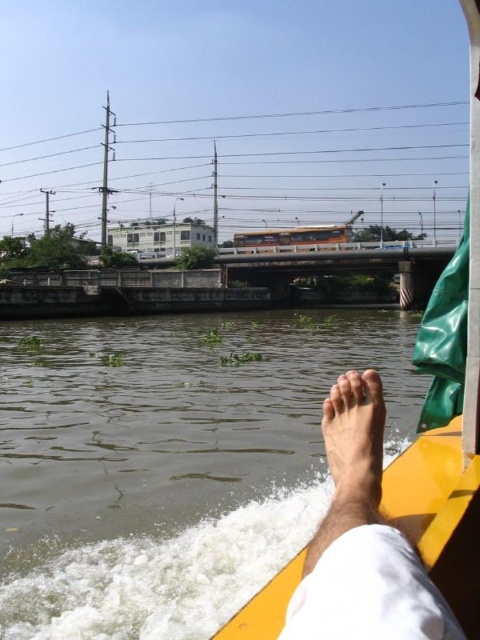
Question: Which point appears farthest from the camera in this image?

Choices:
 (A) (69, 609)
 (B) (381, 413)
 (C) (358, 426)

Answer: (A)

Question: Is brown murky water at lower left further to the viewer compared to skinny barefoot at lower center?

Choices:
 (A) no
 (B) yes

Answer: (B)

Question: Is skinny barefoot at lower center below skinny barefoot at lower right?

Choices:
 (A) yes
 (B) no

Answer: (A)

Question: Which object is positioned farthest from the skinny barefoot at lower center?

Choices:
 (A) skinny barefoot at lower right
 (B) brown murky water at lower left

Answer: (B)

Question: Which point is closer to the camera?

Choices:
 (A) skinny barefoot at lower center
 (B) skinny barefoot at lower right

Answer: (A)

Question: Is skinny barefoot at lower center thinner than skinny barefoot at lower right?

Choices:
 (A) no
 (B) yes

Answer: (A)